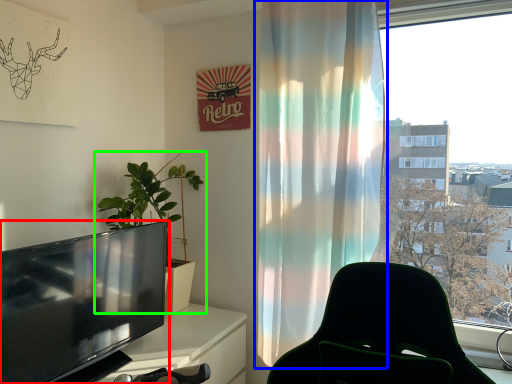
Question: Based on their relative distances, which object is nearer to television (highlighted by a red box)? Choose from curtain (highlighted by a blue box) and houseplant (highlighted by a green box).

Choices:
 (A) curtain
 (B) houseplant

Answer: (B)